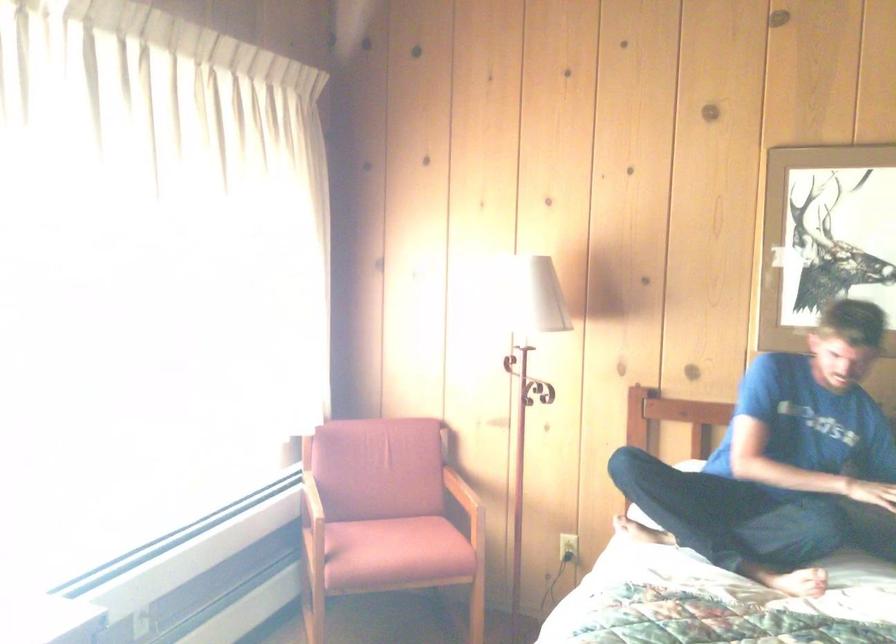
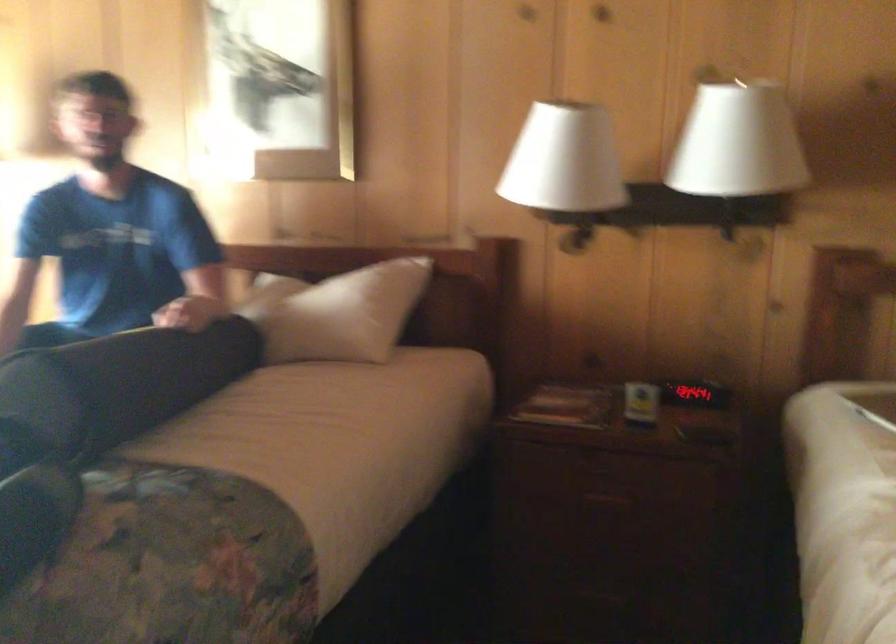
Question: Which direction would the cameraman need to move to produce the second image? Reply with the corresponding letter.

Choices:
 (A) Left
 (B) Right
 (C) Forward
 (D) Backward

Answer: (B)